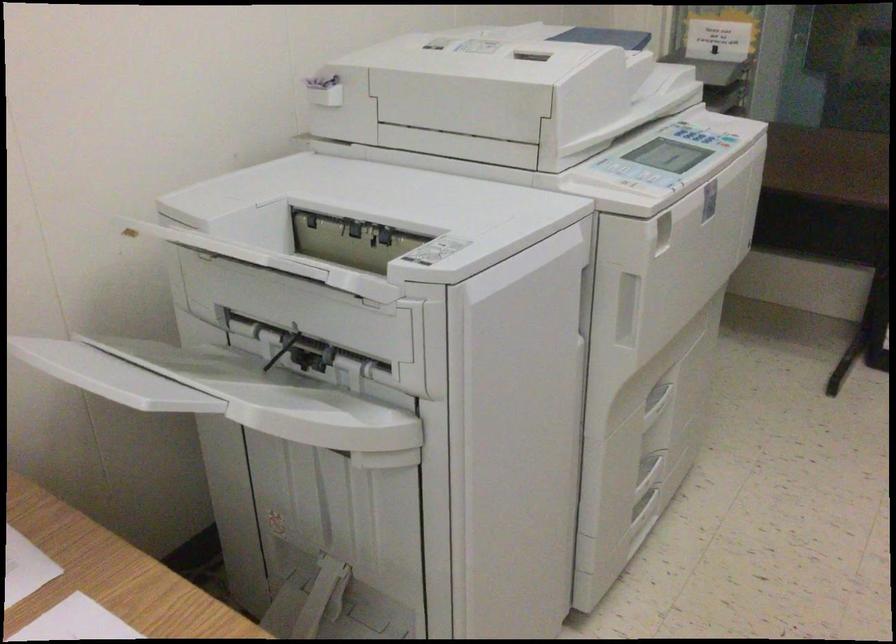
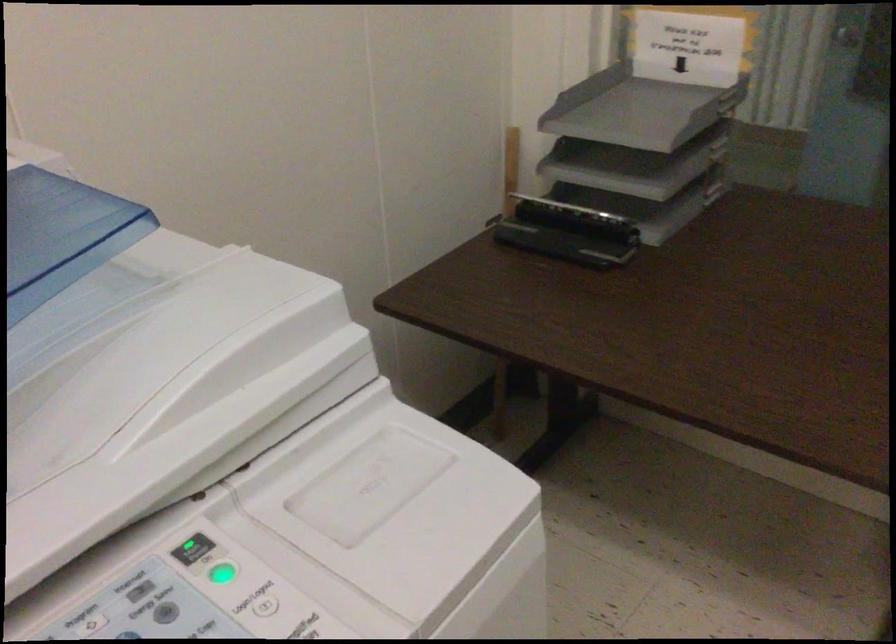
The images are taken continuously from a first-person perspective. In which direction are you moving?

The movement direction of the cameraman is right, forward.